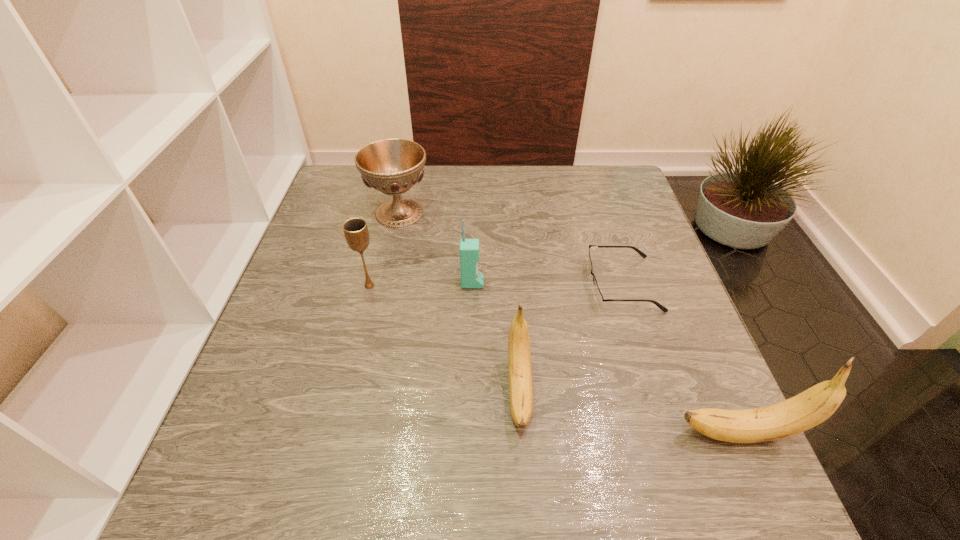
Locate an element on the screen. The width and height of the screenshot is (960, 540). the left banana is located at coordinates (519, 352).

Where is `the third object from right to left`? the third object from right to left is located at coordinates (519, 352).

The image size is (960, 540). I want to click on the right banana, so click(813, 406).

Where is `the tallest object`? the tallest object is located at coordinates (813, 406).

The height and width of the screenshot is (540, 960). In order to click on the farther chalice in this screenshot , I will do `click(392, 166)`.

You are a GUI agent. You are given a task and a screenshot of the screen. Output one action in this format:
    pyautogui.click(x=<x>, y=<y>)
    Task: Click on the shortest object
    The height and width of the screenshot is (540, 960).
    Given the screenshot: What is the action you would take?
    pyautogui.click(x=598, y=297)

At what (x,y) coordinates should I click in order to perform the action: click on the nearer chalice. Please return your answer as a coordinate pair (x, y). This screenshot has width=960, height=540. Looking at the image, I should click on (356, 233).

Locate an element on the screen. cellular telephone is located at coordinates (469, 248).

Find the location of `free spot located at the start of the peel on the right banana`. free spot located at the start of the peel on the right banana is located at coordinates [x=636, y=434].

At what (x,y) coordinates should I click in order to perform the action: click on vacant space situated 0.210m at the start of the peel on the right banana. Please return your answer as a coordinate pair (x, y). Image resolution: width=960 pixels, height=540 pixels. Looking at the image, I should click on (558, 434).